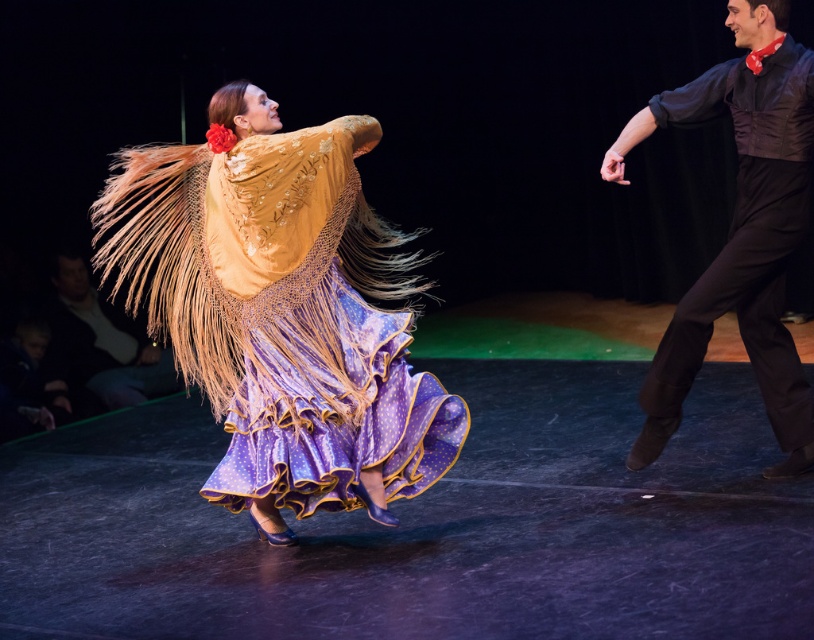
Question: Among these objects, which one is nearest to the camera?

Choices:
 (A) dark brown leather jacket at lower left
 (B) shiny black shirt at right
 (C) velvet/yellow/golden shawl at left

Answer: (C)

Question: Which object is closer to the camera taking this photo?

Choices:
 (A) dark brown leather jacket at lower left
 (B) velvet/yellow/golden shawl at left
 (C) shiny black shirt at right

Answer: (B)

Question: Which object appears closest to the camera in this image?

Choices:
 (A) dark brown leather jacket at lower left
 (B) shiny black shirt at right
 (C) velvet/yellow/golden shawl at left

Answer: (C)

Question: Does shiny black shirt at right have a smaller size compared to dark brown leather jacket at lower left?

Choices:
 (A) no
 (B) yes

Answer: (A)

Question: Can you confirm if shiny black shirt at right is wider than dark brown leather jacket at lower left?

Choices:
 (A) yes
 (B) no

Answer: (B)

Question: Does velvet/yellow/golden shawl at left lie in front of shiny black shirt at right?

Choices:
 (A) no
 (B) yes

Answer: (B)